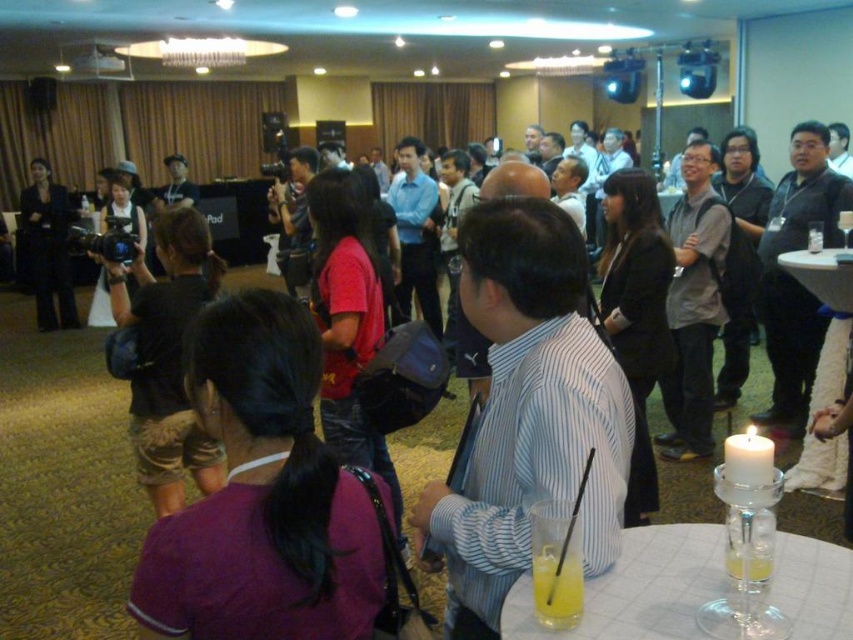
Question: Does black fabric camera at center appear on the right side of matte black suit at left?

Choices:
 (A) no
 (B) yes

Answer: (B)

Question: Which point appears farthest from the camera in this image?

Choices:
 (A) (741, 508)
 (B) (143, 358)

Answer: (B)

Question: Which object is farther from the camera taking this photo?

Choices:
 (A) striped cotton shirt at center
 (B) yellow translucent glass at lower right

Answer: (A)

Question: In this image, where is purple fabric shirt at lower left located relative to clear glass candle at lower right?

Choices:
 (A) below
 (B) above

Answer: (B)

Question: Which point is farther from the camera taking this photo?

Choices:
 (A) (576, 618)
 (B) (158, 417)
 (C) (830, 268)
 (D) (583, 465)

Answer: (C)

Question: Does clear glass candle at lower right appear under matte black suit at left?

Choices:
 (A) yes
 (B) no

Answer: (A)